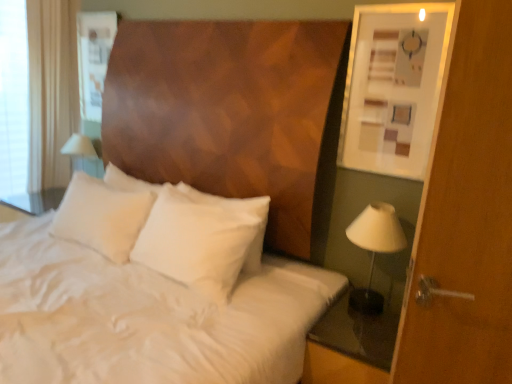
Question: From the image's perspective, is white fabric at left above transparent glass nightstand at lower right?

Choices:
 (A) yes
 (B) no

Answer: (A)

Question: From a real-world perspective, does white fabric at left sit lower than transparent glass nightstand at lower right?

Choices:
 (A) yes
 (B) no

Answer: (B)

Question: From the image's perspective, is white fabric at left beneath transparent glass nightstand at lower right?

Choices:
 (A) yes
 (B) no

Answer: (B)

Question: Is white fabric at left not close to transparent glass nightstand at lower right?

Choices:
 (A) yes
 (B) no

Answer: (A)

Question: Is white fabric at left thinner than transparent glass nightstand at lower right?

Choices:
 (A) no
 (B) yes

Answer: (B)

Question: Is white fabric at left aimed at transparent glass nightstand at lower right?

Choices:
 (A) no
 (B) yes

Answer: (A)

Question: From the image's perspective, is white satin bedsheet at center over white fabric at left?

Choices:
 (A) yes
 (B) no

Answer: (B)

Question: Is white satin bedsheet at center aimed at white fabric at left?

Choices:
 (A) yes
 (B) no

Answer: (B)

Question: Is white satin bedsheet at center in front of white fabric at left?

Choices:
 (A) no
 (B) yes

Answer: (B)

Question: From a real-world perspective, is white satin bedsheet at center on top of white fabric at left?

Choices:
 (A) yes
 (B) no

Answer: (B)

Question: Is white fabric at left surrounded by white satin bedsheet at center?

Choices:
 (A) no
 (B) yes

Answer: (A)

Question: From the image's perspective, does white satin bedsheet at center appear lower than white fabric at left?

Choices:
 (A) yes
 (B) no

Answer: (A)

Question: Is white fabric at left oriented towards white fabric lampshade at right?

Choices:
 (A) yes
 (B) no

Answer: (B)